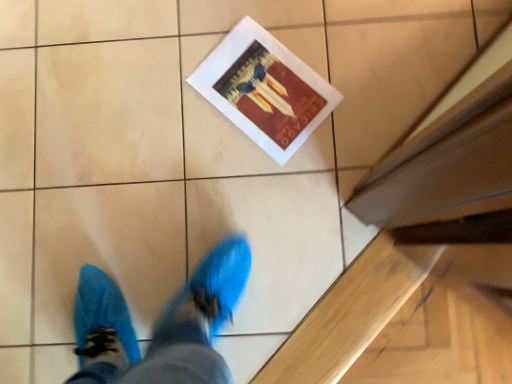
The width and height of the screenshot is (512, 384). Find the location of `vacant space in matte paper postcard at center (from a real-world perspective)`. vacant space in matte paper postcard at center (from a real-world perspective) is located at coordinates (267, 83).